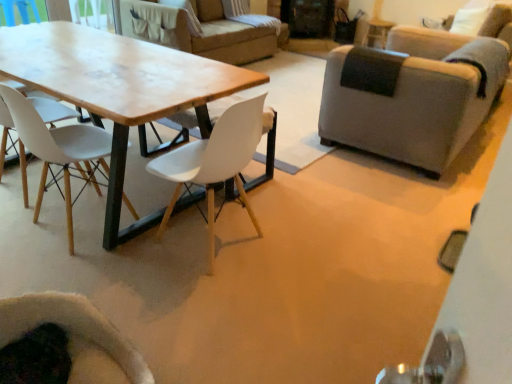
Identify the location of free space in front of white matte chair at center, positioned as the 3th chair in left-to-right order. Image resolution: width=512 pixels, height=384 pixels. (213, 302).